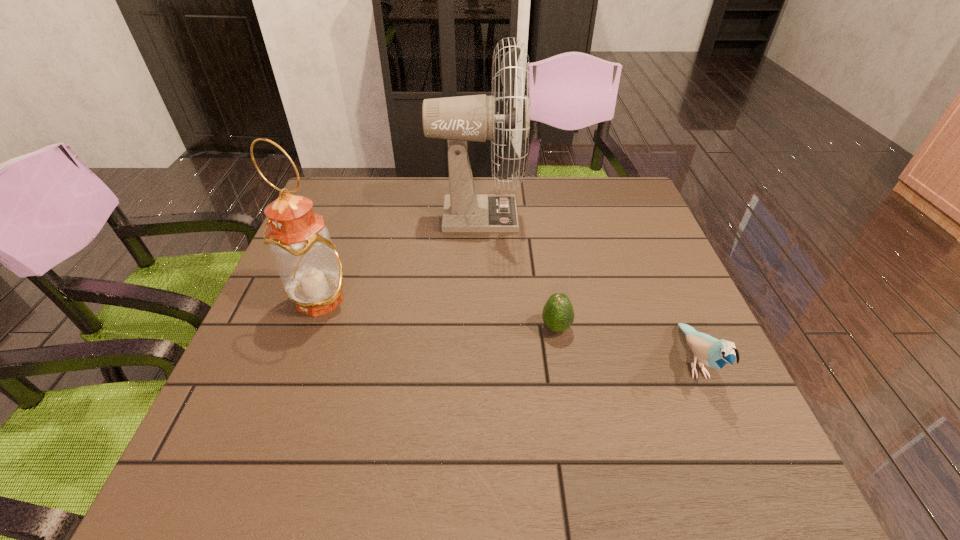
Find the location of a particular element. the farthest object is located at coordinates (459, 119).

Find the location of a particular element. The image size is (960, 540). the second object from left to right is located at coordinates (459, 119).

Locate an element on the screen. The height and width of the screenshot is (540, 960). the leftmost object is located at coordinates (310, 269).

The height and width of the screenshot is (540, 960). Identify the location of oil lamp. (310, 269).

Find the location of a particular element. bird is located at coordinates (712, 352).

Find the location of a particular element. the third tallest object is located at coordinates (712, 352).

Where is `avocado`? avocado is located at coordinates (558, 315).

I want to click on the shortest object, so point(558,315).

This screenshot has height=540, width=960. Find the location of `free location located on the air flow direction of the farthest object`. free location located on the air flow direction of the farthest object is located at coordinates (648, 215).

What are the coordinates of `vacant space located on the right of the second tallest object` in the screenshot? It's located at (390, 300).